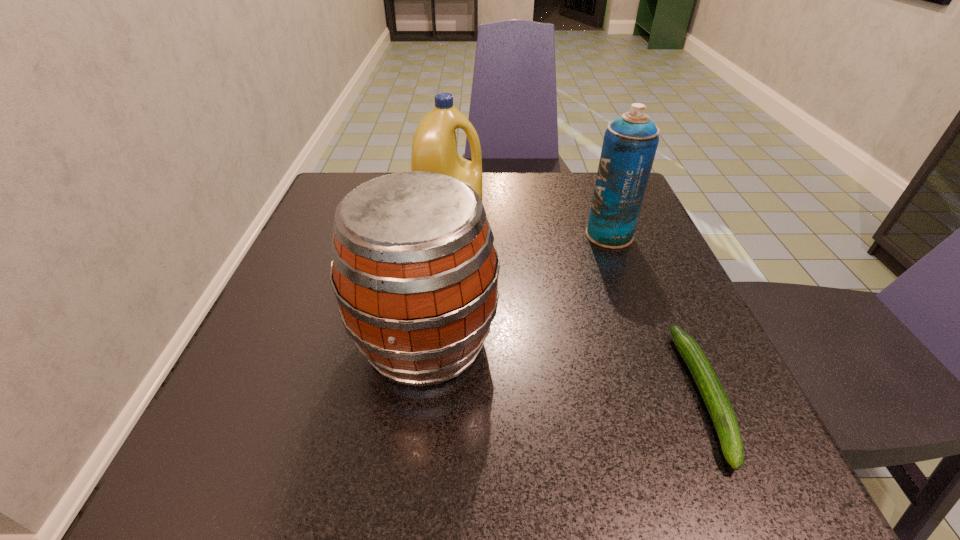
This screenshot has height=540, width=960. What are the coordinates of `free point that satisfies the following two spatial constraints: 1. on the back side of the aerosol can; 2. on the left side of the cider` in the screenshot? It's located at (438, 235).

Where is `vacant space that satisfies the following two spatial constraints: 1. on the label of the detergent; 2. on the right side of the aerosol can`? vacant space that satisfies the following two spatial constraints: 1. on the label of the detergent; 2. on the right side of the aerosol can is located at coordinates (449, 235).

This screenshot has height=540, width=960. I want to click on vacant position in the image that satisfies the following two spatial constraints: 1. on the label of the aerosol can; 2. on the left side of the detergent, so click(x=449, y=235).

This screenshot has height=540, width=960. In order to click on free location that satisfies the following two spatial constraints: 1. on the label of the aerosol can; 2. on the left side of the detergent in this screenshot , I will do `click(449, 235)`.